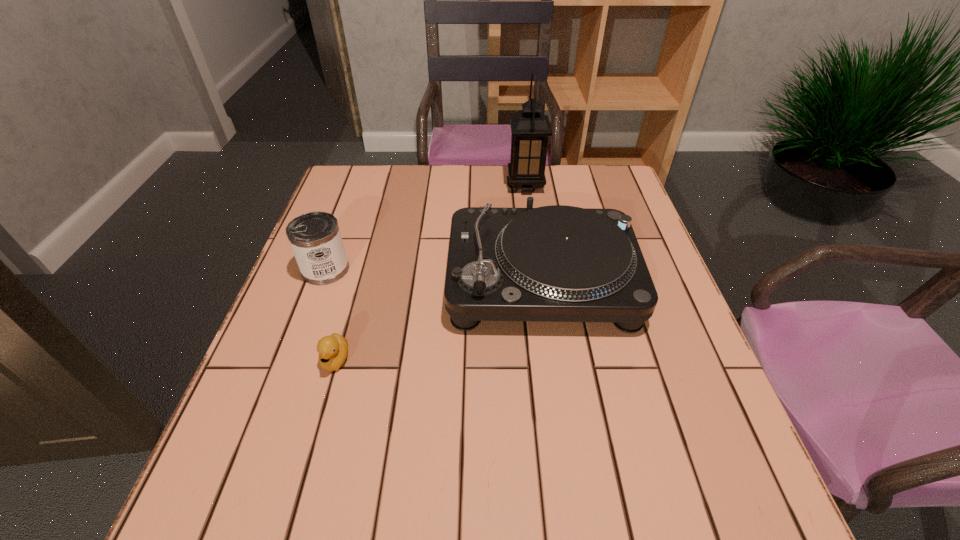
Identify the location of the tallest object. (530, 127).

Where is `lantern`? The image size is (960, 540). lantern is located at coordinates (530, 127).

Image resolution: width=960 pixels, height=540 pixels. I want to click on record player, so click(557, 263).

I want to click on the leftmost object, so click(x=315, y=238).

Locate an element on the screen. the shortest object is located at coordinates (333, 349).

Find the location of a particular element. duckling is located at coordinates (333, 349).

Where is `vacant space located on the right of the lantern`? The height and width of the screenshot is (540, 960). vacant space located on the right of the lantern is located at coordinates (613, 185).

At what (x,y) coordinates should I click in order to perform the action: click on free region located 0.130m on the front of the record player. Please return your answer as a coordinate pair (x, y). This screenshot has width=960, height=540. Looking at the image, I should click on (557, 393).

Where is `vacant area situated 0.360m on the back of the leftmost object`? The width and height of the screenshot is (960, 540). vacant area situated 0.360m on the back of the leftmost object is located at coordinates (359, 178).

I want to click on vacant space located 0.190m facing forward on the duckling, so click(x=302, y=477).